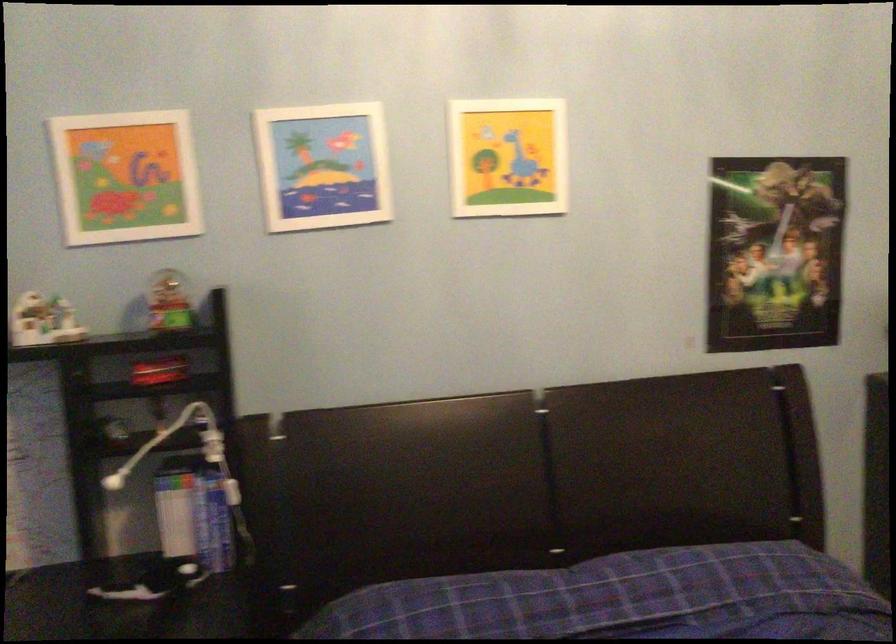
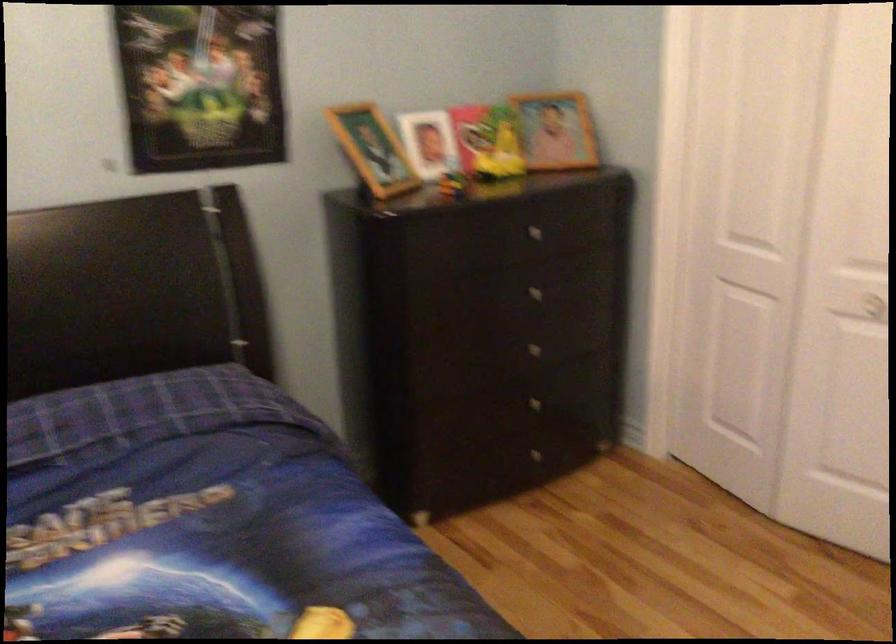
Question: The camera is either moving clockwise (left) or counter-clockwise (right) around the object. The first image is from the beginning of the video and the second image is from the end. Is the camera moving left or right when shooting the video?

Choices:
 (A) Left
 (B) Right

Answer: (A)